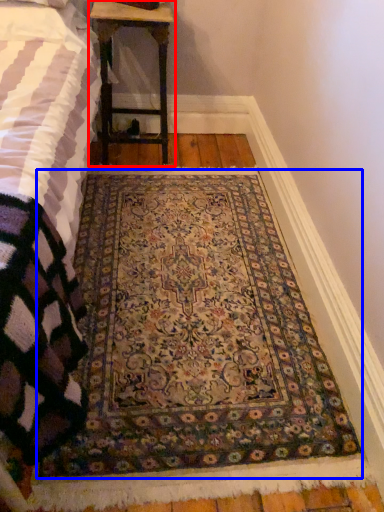
Question: Which of the following is the closest to the observer, table (highlighted by a red box) or mat (highlighted by a blue box)?

Choices:
 (A) table
 (B) mat

Answer: (B)